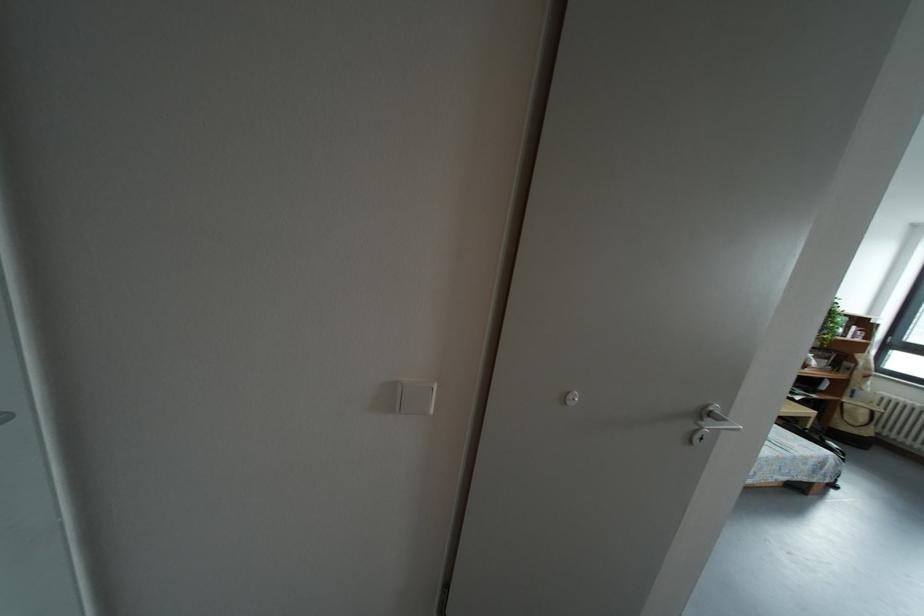
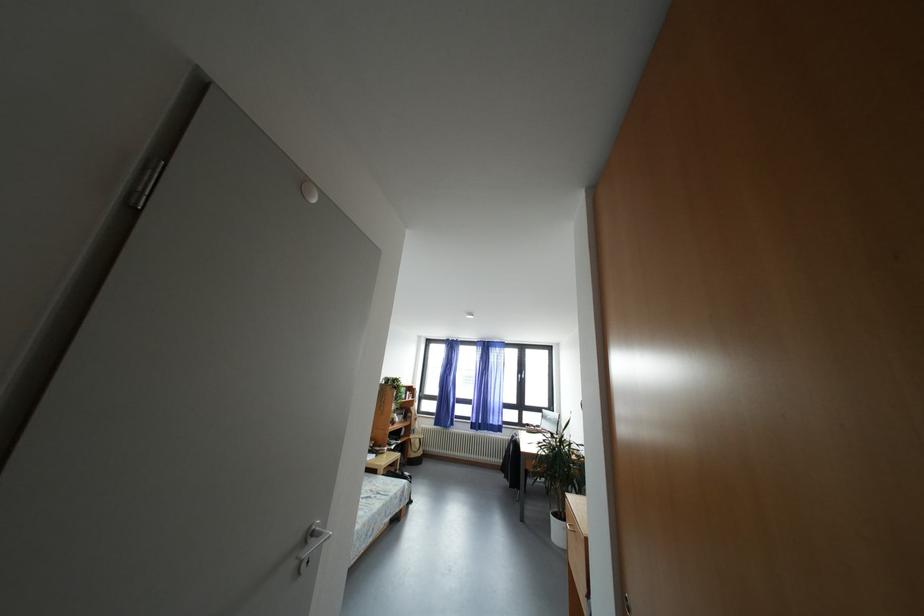
Where in the second image is the point corresponding to point (718, 419) from the first image?

(320, 539)